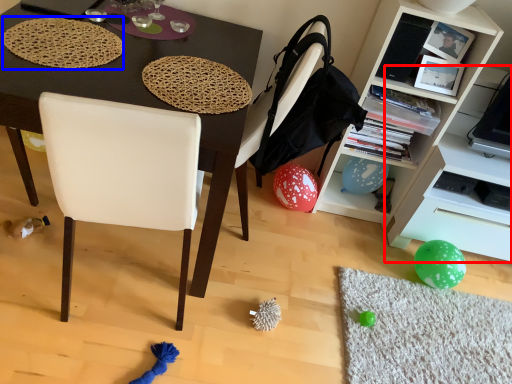
Question: Which object is closer to the camera taking this photo, shelf (highlighted by a red box) or mat (highlighted by a blue box)?

Choices:
 (A) shelf
 (B) mat

Answer: (B)